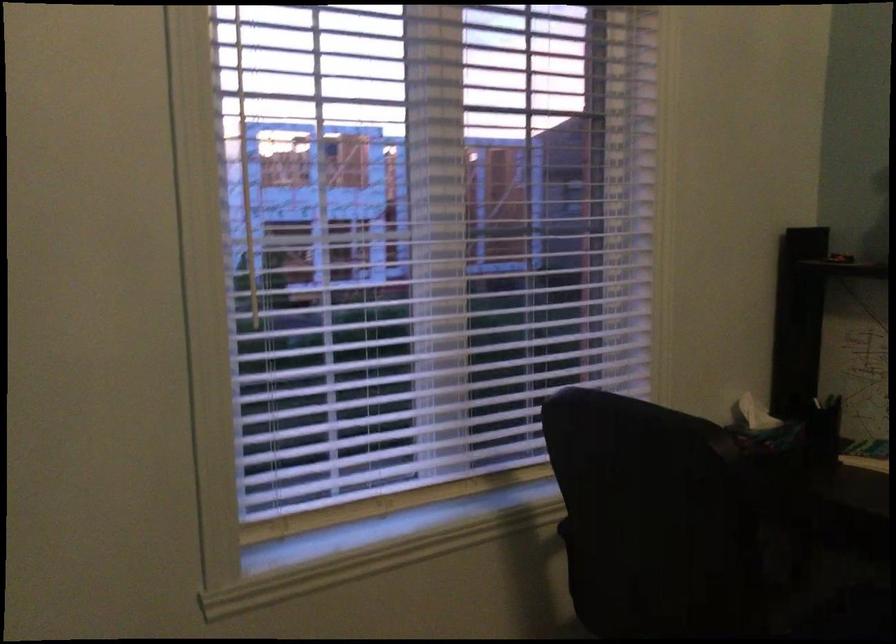
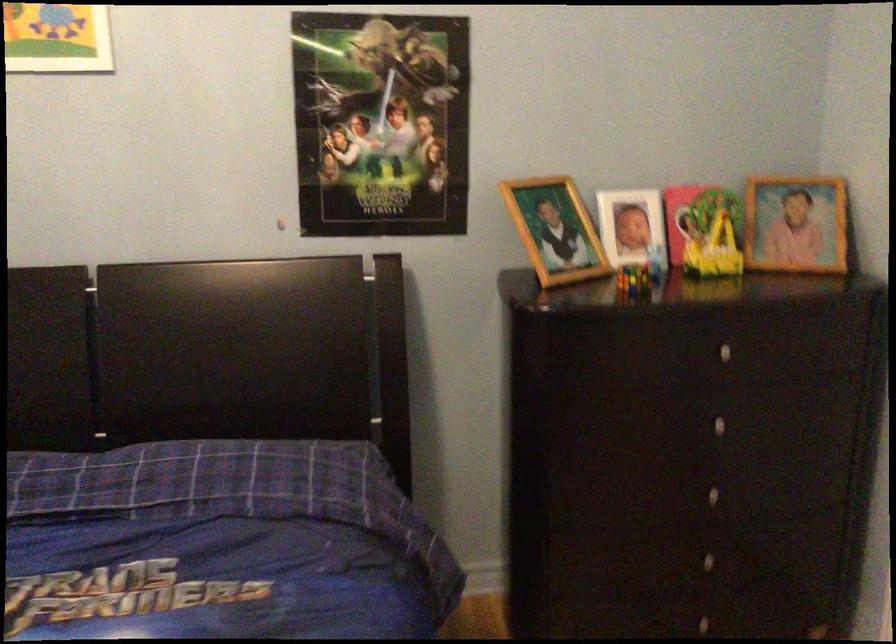
Question: How did the camera likely rotate?

Choices:
 (A) Left
 (B) Right
 (C) Up
 (D) Down

Answer: (B)